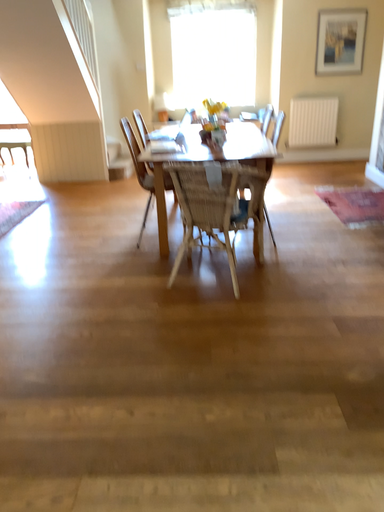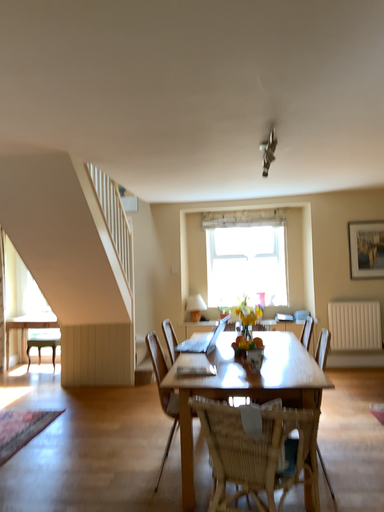
Question: How did the camera likely rotate when shooting the video?

Choices:
 (A) rotated upward
 (B) rotated downward

Answer: (A)